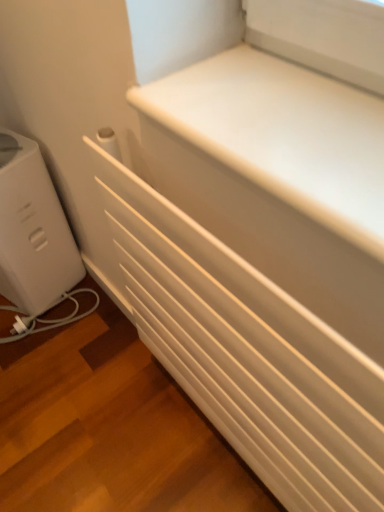
Question: Is point (77, 358) closer or farther from the camera than point (23, 245)?

Choices:
 (A) farther
 (B) closer

Answer: (A)

Question: Is white matte radiator at lower left inside or outside of white plastic toaster at left?

Choices:
 (A) outside
 (B) inside

Answer: (A)

Question: Which object is the farthest from the white plastic toaster at left?

Choices:
 (A) white matte radiator at center
 (B) white matte radiator at lower left

Answer: (A)

Question: Which object is the farthest from the white plastic toaster at left?

Choices:
 (A) white matte radiator at lower left
 (B) white matte radiator at center

Answer: (B)